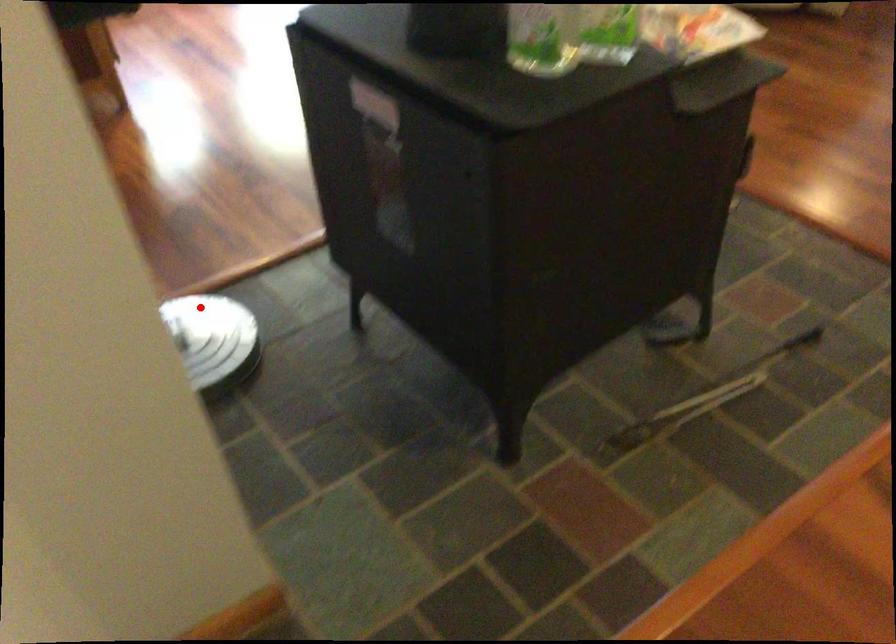
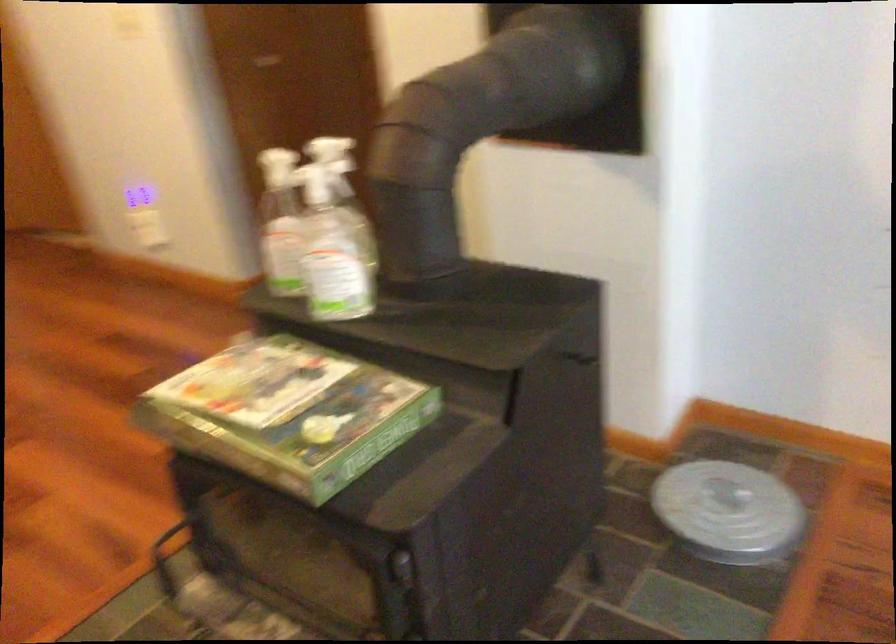
Find the pixel in the second image that matches the highlighted location in the first image.

(728, 512)